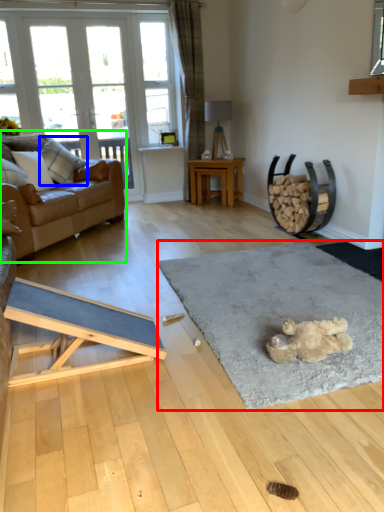
Question: Based on their relative distances, which object is farther from mat (highlighted by a red box)? Choose from pillow (highlighted by a blue box) and studio couch (highlighted by a green box).

Choices:
 (A) pillow
 (B) studio couch

Answer: (A)